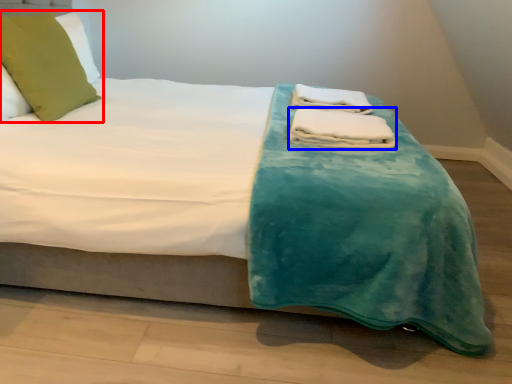
Question: Among these objects, which one is nearest to the camera, pillow (highlighted by a red box) or bath towel (highlighted by a blue box)?

Choices:
 (A) pillow
 (B) bath towel

Answer: (B)